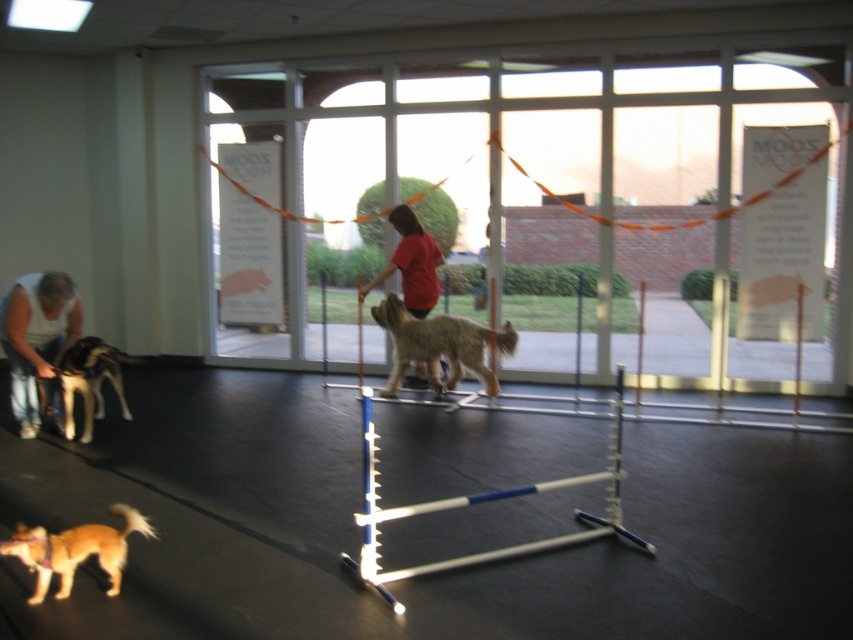
You are a photographer setting up for a photo shoot in the described scene. You need to position a light source between the transparent glass door at center and the red cotton shirt at center. Given that the distance between them is 4.26 feet, what is the minimum width of the light source needed to cover the space between them without overlapping either object?

The minimum width of the light source needed to cover the space between the transparent glass door at center and the red cotton shirt at center is 4.26 feet, as they are 4.26 feet apart.